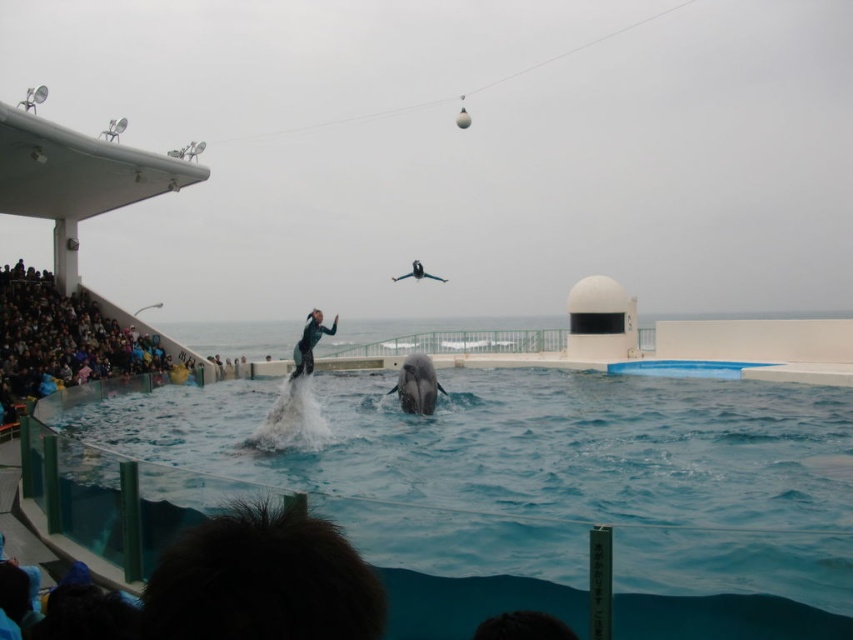
Who is lower down, gray smooth dolphin at center or green wetsuit at center?

gray smooth dolphin at center

Between gray smooth dolphin at center and green wetsuit at center, which one appears on the left side from the viewer's perspective?

From the viewer's perspective, green wetsuit at center appears more on the left side.

Is point (401, 381) closer to camera compared to point (305, 323)?

No, it is not.

Where is `gray smooth dolphin at center`? gray smooth dolphin at center is located at coordinates (416, 385).

Who is taller, clear blue water at lower center or gray smooth dolphin at center?

clear blue water at lower center

Does clear blue water at lower center have a greater width compared to gray smooth dolphin at center?

Correct, the width of clear blue water at lower center exceeds that of gray smooth dolphin at center.

Between point (514, 433) and point (428, 381), which one is positioned behind?

Point (428, 381)

This screenshot has width=853, height=640. Identify the location of clear blue water at lower center. (511, 490).

This screenshot has width=853, height=640. What do you see at coordinates (61, 340) in the screenshot?
I see `dark blue fabric crowd at lower left` at bounding box center [61, 340].

Between dark blue fabric crowd at lower left and gray smooth dolphin at center, which one appears on the right side from the viewer's perspective?

Positioned to the right is gray smooth dolphin at center.

At what (x,y) coordinates should I click in order to perform the action: click on dark blue fabric crowd at lower left. Please return your answer as a coordinate pair (x, y). This screenshot has width=853, height=640. Looking at the image, I should click on (61, 340).

At what (x,y) coordinates should I click in order to perform the action: click on dark blue fabric crowd at lower left. Please return your answer as a coordinate pair (x, y). This screenshot has height=640, width=853. Looking at the image, I should click on (61, 340).